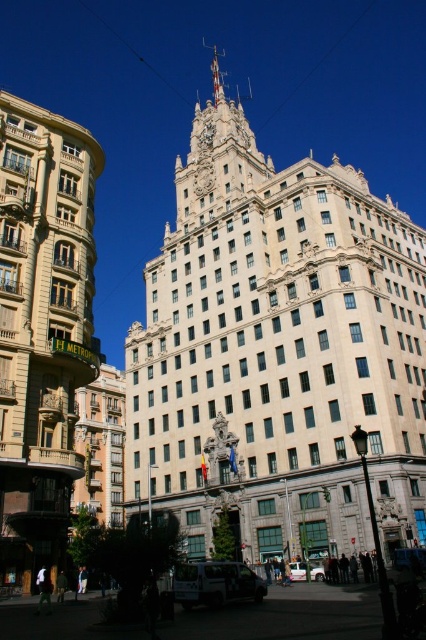
You are standing in front of two buildings, the white stone building at center and the brown textured building at left. Which building is located to the left of the other?

The brown textured building at left is located to the left of the white stone building at center.

Based on the photo, you are an urban planner reviewing the cityscape. You need to determine which building, the white stone building at center or the brown textured building at left, has a greater floor area. Based on the scene, which one would you choose?

The white stone building at center is larger in size than the brown textured building at left, so it likely has a greater floor area.

You are standing in front of a grand Art Deco building and want to take a photo of the entire white stone building at center. Your camera has a maximum zoom range of 40 meters. Will you be able to capture the entire building in one shot without moving closer?

The white stone building at center is 45.17 meters away from the camera. Since the camera can only zoom up to 40 meters, you will not be able to capture the entire building in one shot without moving closer.